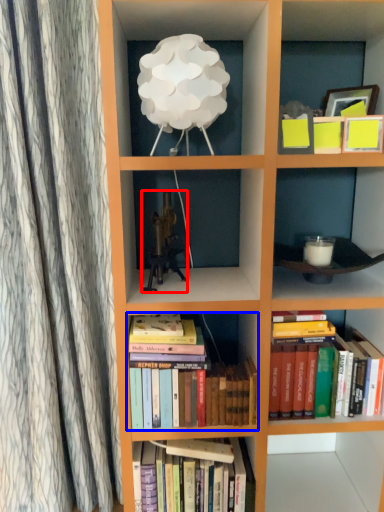
Question: Which of the following is the farthest to the observer, toy (highlighted by a red box) or book (highlighted by a blue box)?

Choices:
 (A) toy
 (B) book

Answer: (A)